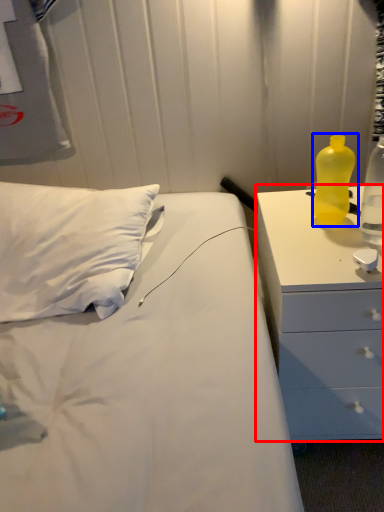
Question: Among these objects, which one is nearest to the camera, chest of drawers (highlighted by a red box) or bottle (highlighted by a blue box)?

Choices:
 (A) chest of drawers
 (B) bottle

Answer: (A)